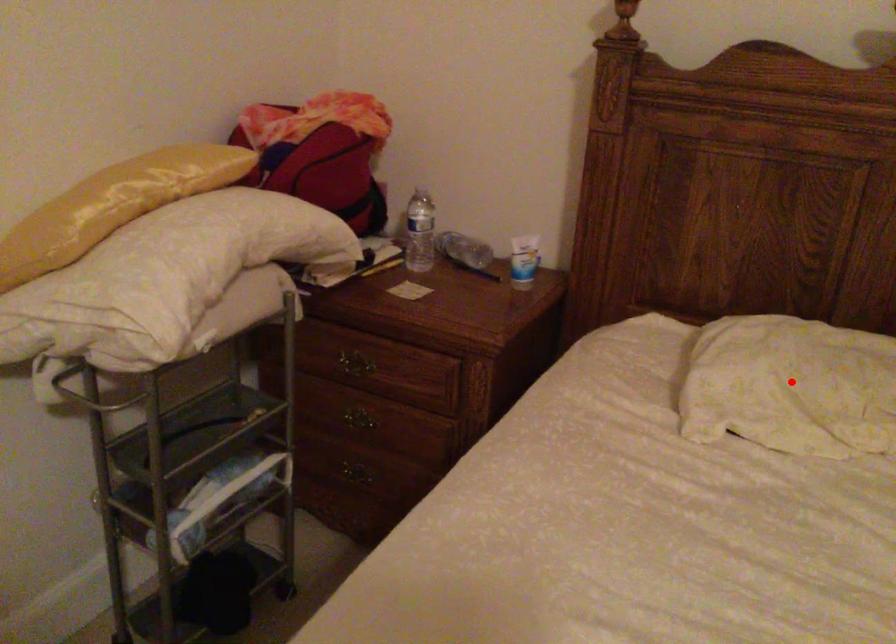
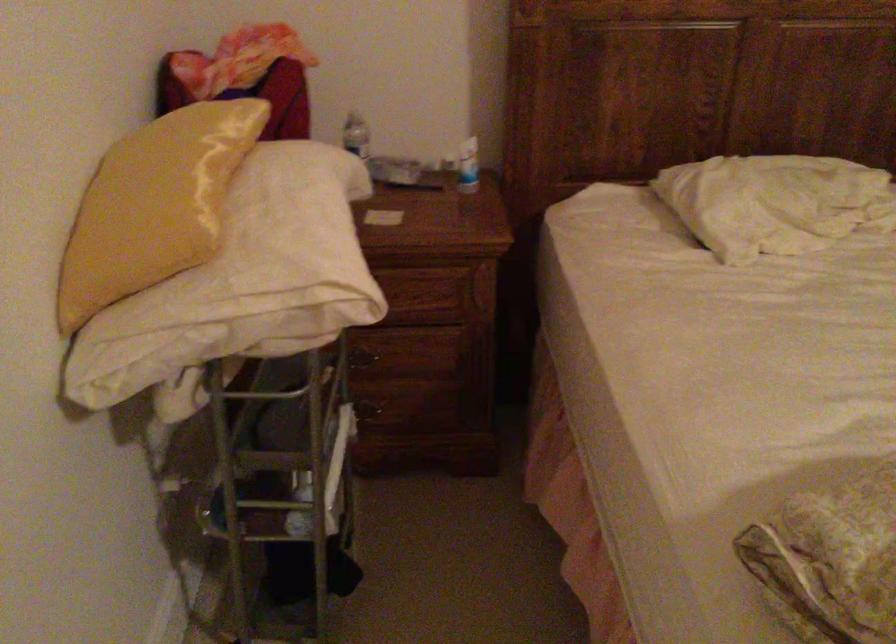
Find the pixel in the second image that matches the highlighted location in the first image.

(774, 202)